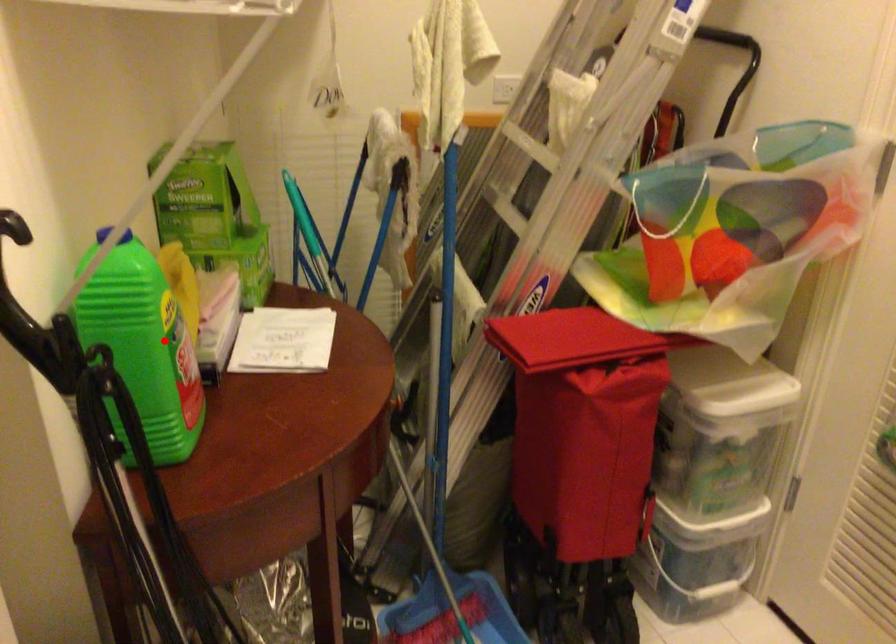
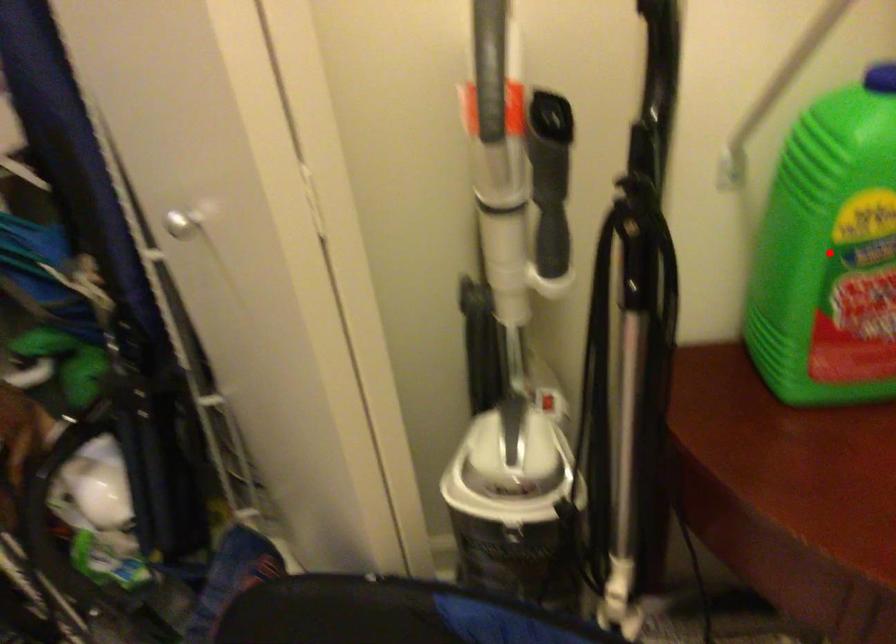
I am providing you with two images of the same scene from different viewpoints. A red point is marked on the first image and another point is marked on the second image. Does the point marked in image1 correspond to the same location as the one in image2?

Yes